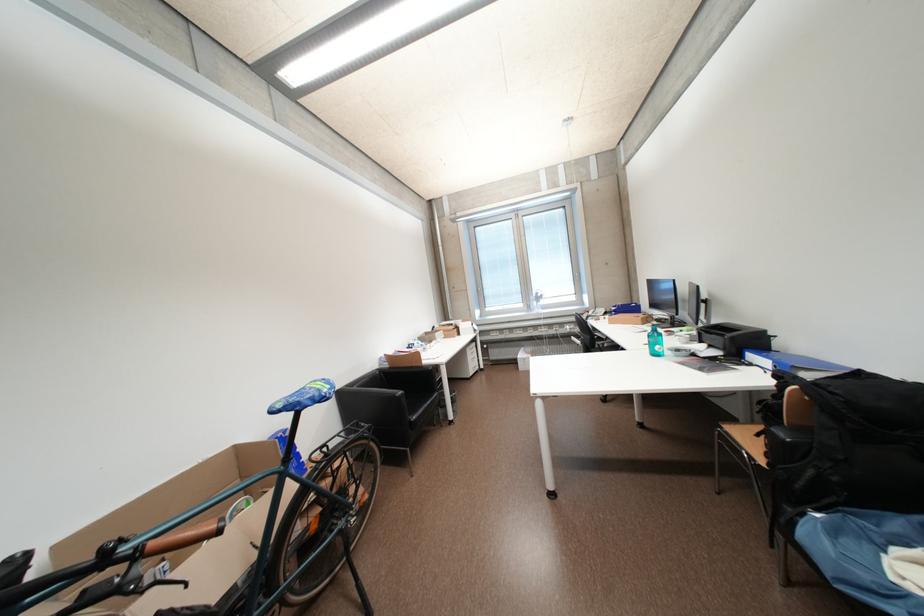
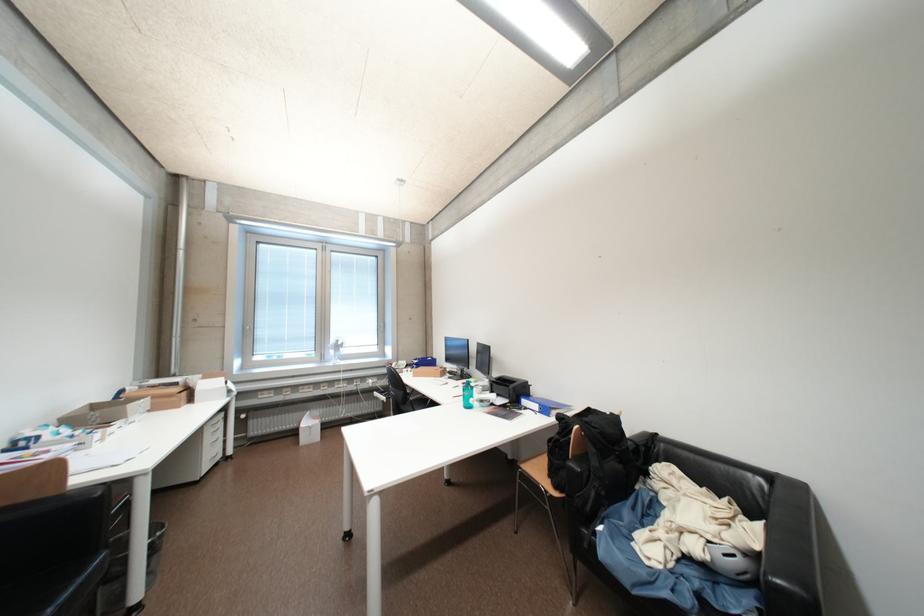
Locate, in the second image, the point that corresponds to pixel 775 459 in the first image.

(564, 488)